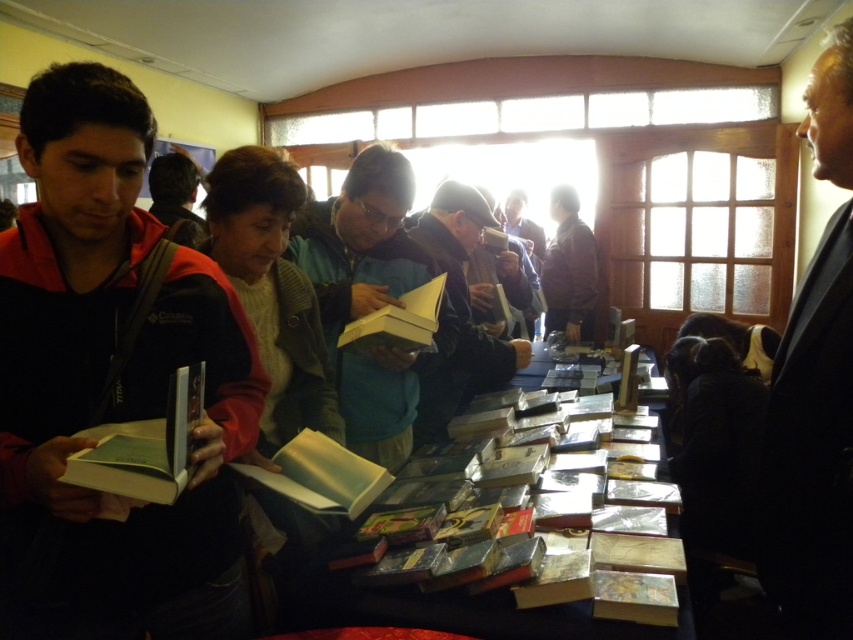
Question: Estimate the real-world distances between objects in this image. Which object is farther from the dark gray fabric jacket at center?

Choices:
 (A) shiny black table at center
 (B) dark blue jacket at left
 (C) teal fabric jacket at center

Answer: (B)

Question: Does hardcover book at left lie in front of yellow paper book at center?

Choices:
 (A) no
 (B) yes

Answer: (B)

Question: Considering the real-world distances, which object is farthest from the black suit at right?

Choices:
 (A) yellow paper book at center
 (B) hardcover book at left
 (C) teal fabric jacket at center

Answer: (C)

Question: Which object appears farthest from the camera in this image?

Choices:
 (A) hardcover book at left
 (B) dark gray fabric jacket at center
 (C) shiny black table at center

Answer: (B)

Question: Does black suit at right have a larger size compared to white paper book at center?

Choices:
 (A) yes
 (B) no

Answer: (A)

Question: Is the position of black suit at right more distant than that of dark gray fabric jacket at center?

Choices:
 (A) no
 (B) yes

Answer: (A)